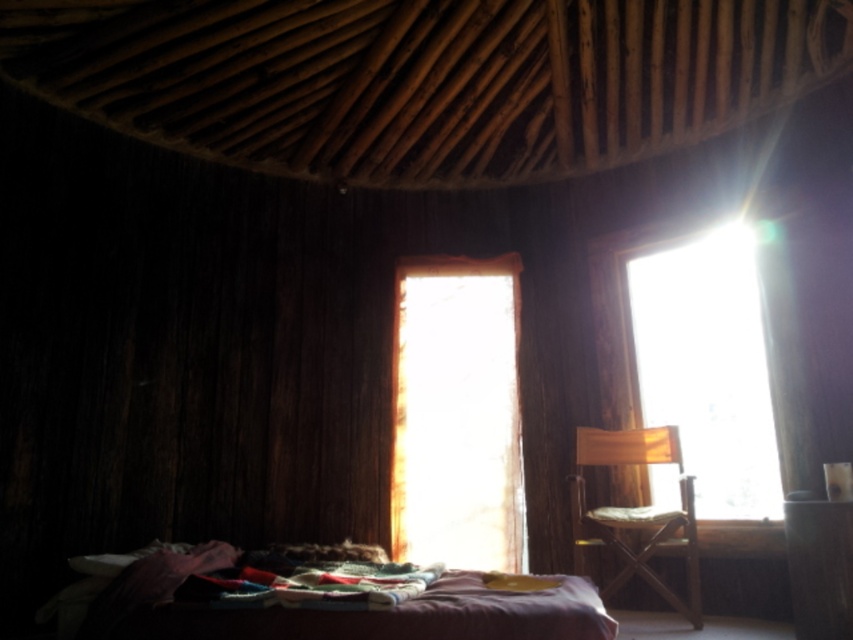
Question: Is the position of transparent glass window at upper right less distant than that of wooden director's chair at center?

Choices:
 (A) no
 (B) yes

Answer: (A)

Question: Which of the following is the farthest from the observer?

Choices:
 (A) (579, 556)
 (B) (397, 630)

Answer: (A)

Question: Is purple fabric bed at lower center closer to the viewer compared to wooden director's chair at center?

Choices:
 (A) yes
 (B) no

Answer: (A)

Question: Estimate the real-world distances between objects in this image. Which object is farther from the transparent glass window at upper right?

Choices:
 (A) wooden director's chair at center
 (B) purple fabric bed at lower center
 (C) translucent fabric at center

Answer: (B)

Question: Which point is closer to the camera?

Choices:
 (A) purple fabric bed at lower center
 (B) wooden director's chair at center
 (C) transparent glass window at upper right
 (D) translucent fabric at center

Answer: (A)

Question: Is transparent glass window at upper right thinner than wooden director's chair at center?

Choices:
 (A) no
 (B) yes

Answer: (A)